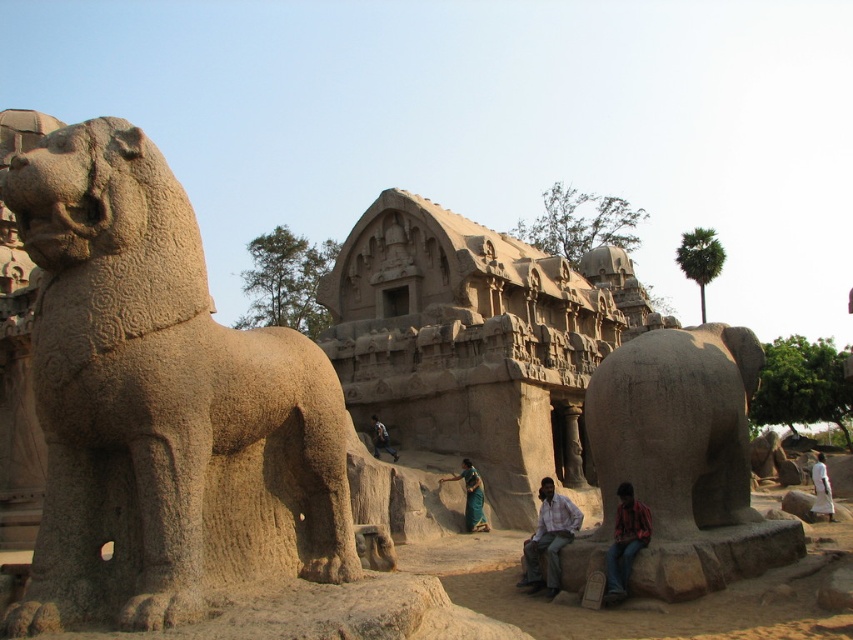
You are a tourist standing in front of the historical site. You want to take a photo of both the gray stone lion at left and the light brown stone statue at center. Which statue should you focus on first to ensure both are in the frame?

You should focus on the gray stone lion at left first since it is closer to you than the light brown stone statue at center, allowing both to be captured in the photo.

You are standing at the entrance of the ancient temple complex and want to reach a specific point marked at coordinates point (306,468). If your walking speed is 3 feet per second, how many seconds will it take you to reach that point?

The distance of point (306,468) from viewer is 136.33 feet. At a walking speed of 3 feet per second, it will take approximately 45.44 seconds to reach the point.

You are standing at the entrance of the historical site and want to take a photo of both the red plaid shirt at lower right and the green silk saree at center. Given that your camera has a maximum focus range of 25 meters, will you be able to capture both items clearly in the same photo?

The red plaid shirt at lower right is 25.97 meters away from the green silk saree at center. Since the distance between them exceeds the camera maximum focus range of 25 meters, you cannot capture both items clearly in the same photo.